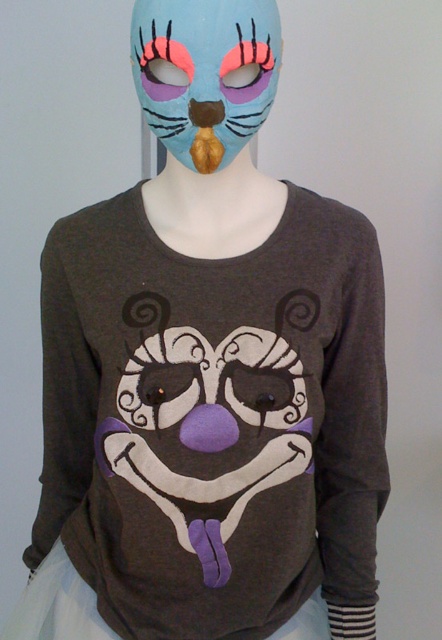
Question: Which point is farther to the camera?

Choices:
 (A) matte gray sweatshirt at center
 (B) matte blue mask at upper center

Answer: (A)

Question: Can you confirm if matte gray sweatshirt at center is bigger than matte blue mask at upper center?

Choices:
 (A) no
 (B) yes

Answer: (B)

Question: Does matte gray sweatshirt at center appear over matte blue mask at upper center?

Choices:
 (A) yes
 (B) no

Answer: (B)

Question: Which point is closer to the camera?

Choices:
 (A) matte blue mask at upper center
 (B) matte gray sweatshirt at center

Answer: (A)

Question: Which point appears farthest from the camera in this image?

Choices:
 (A) (114, 360)
 (B) (155, 86)

Answer: (A)

Question: Does matte gray sweatshirt at center appear over matte blue mask at upper center?

Choices:
 (A) yes
 (B) no

Answer: (B)